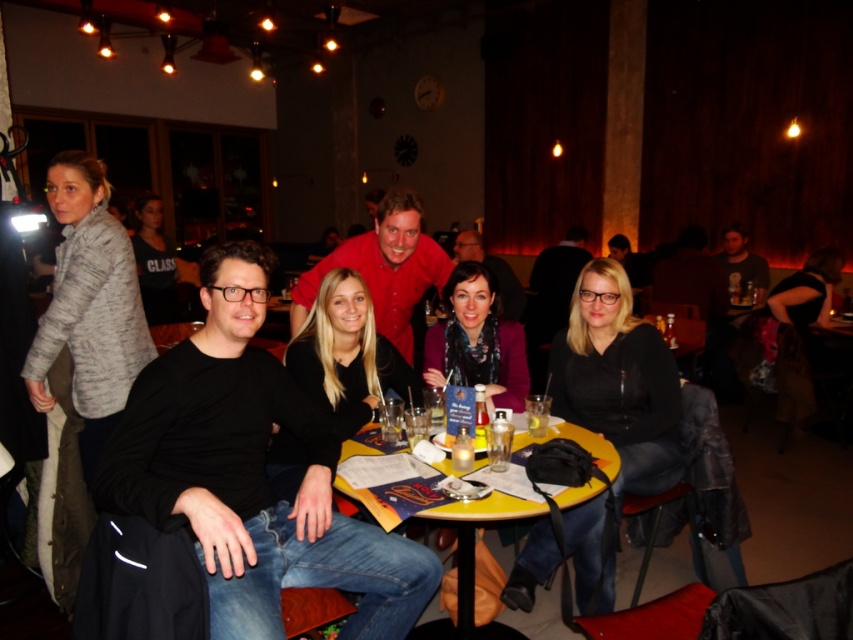
Is yellowwoodentable at center to the right of clear plastic cup at table center from the viewer's perspective?

In fact, yellowwoodentable at center is to the left of clear plastic cup at table center.

Between yellowwoodentable at center and clear plastic cup at table center, which one has less height?

With less height is clear plastic cup at table center.

Who is more forward, (575, 493) or (532, 413)?

Positioned in front is point (575, 493).

Identify the location of yellowwoodentable at center. The height and width of the screenshot is (640, 853). (473, 541).